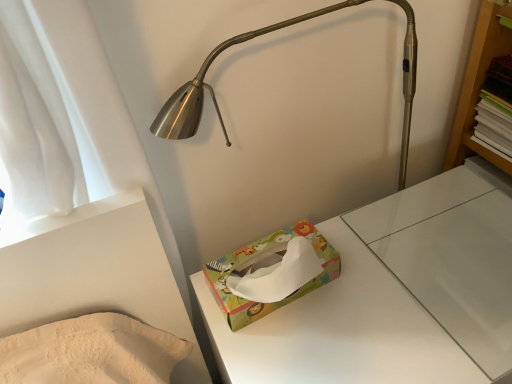
Question: Considering their positions, is multicolored paper tissue box at center located in front of or behind multicolored paper tissue box at center?

Choices:
 (A) front
 (B) behind

Answer: (A)

Question: Choose the correct answer: Is multicolored paper tissue box at center inside multicolored paper tissue box at center or outside it?

Choices:
 (A) inside
 (B) outside

Answer: (B)

Question: From a real-world perspective, relative to multicolored paper tissue box at center, is multicolored paper tissue box at center vertically above or below?

Choices:
 (A) above
 (B) below

Answer: (B)

Question: Considering the positions of point (217, 296) and point (429, 334), is point (217, 296) closer or farther from the camera than point (429, 334)?

Choices:
 (A) farther
 (B) closer

Answer: (A)

Question: Considering the positions of multicolored paper tissue box at center and multicolored paper tissue box at center in the image, is multicolored paper tissue box at center taller or shorter than multicolored paper tissue box at center?

Choices:
 (A) tall
 (B) short

Answer: (B)

Question: Is multicolored paper tissue box at center in front of or behind multicolored paper tissue box at center in the image?

Choices:
 (A) front
 (B) behind

Answer: (B)

Question: Based on their sizes in the image, would you say multicolored paper tissue box at center is bigger or smaller than multicolored paper tissue box at center?

Choices:
 (A) big
 (B) small

Answer: (B)